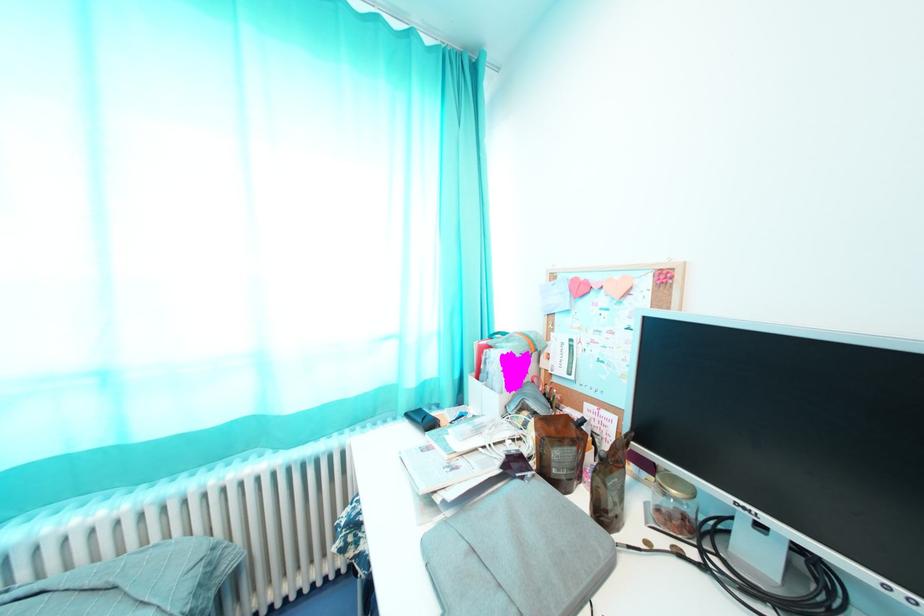
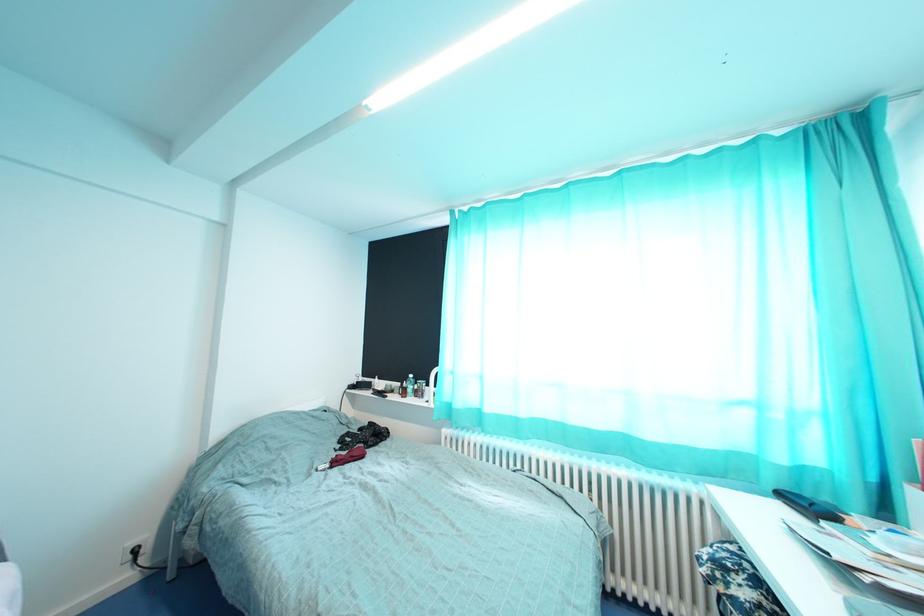
Question: Based on the continuous images, in which direction is the camera rotating? Reply with the corresponding letter.

Choices:
 (A) Left
 (B) Right
 (C) Up
 (D) Down

Answer: (A)